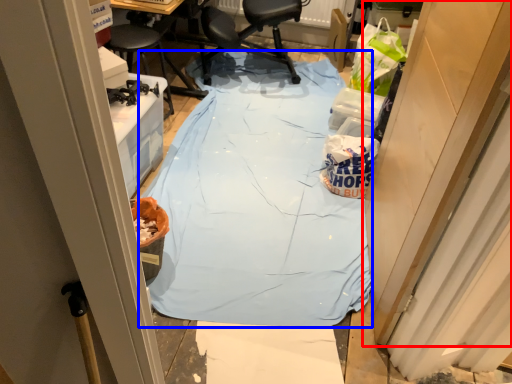
Question: Which of the following is the closest to the observer, door (highlighted by a red box) or tablecloth (highlighted by a blue box)?

Choices:
 (A) door
 (B) tablecloth

Answer: (A)